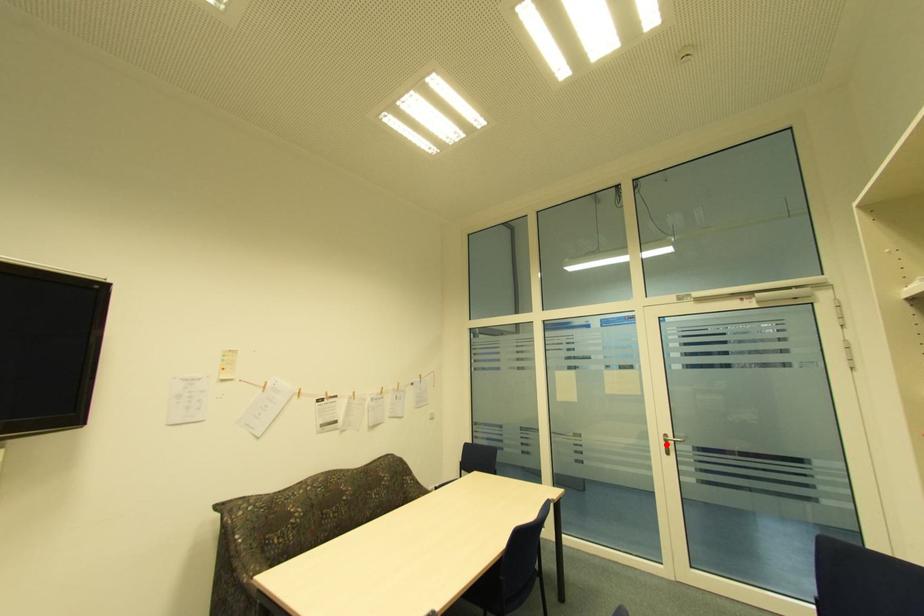
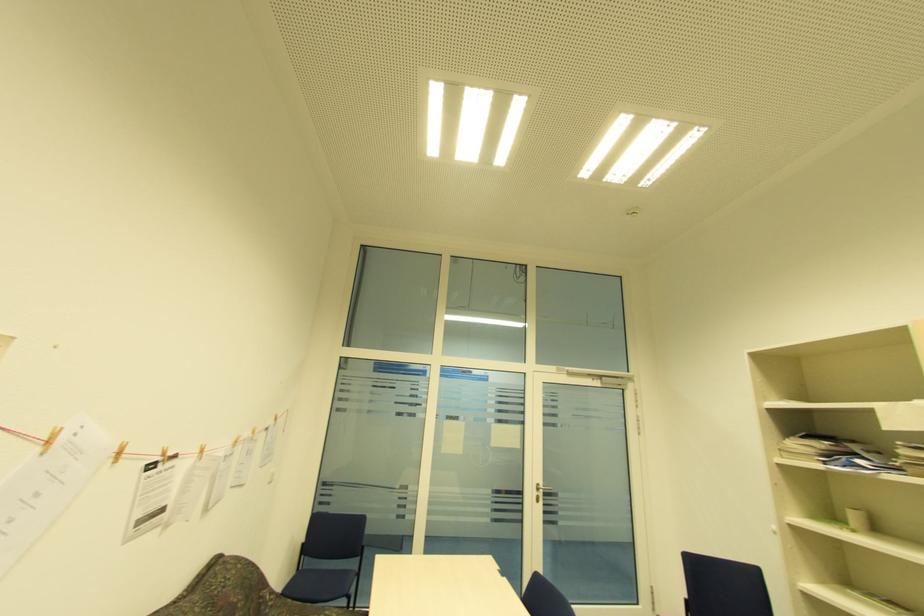
Find the pixel in the second image that matches the highlighted location in the first image.

(538, 493)